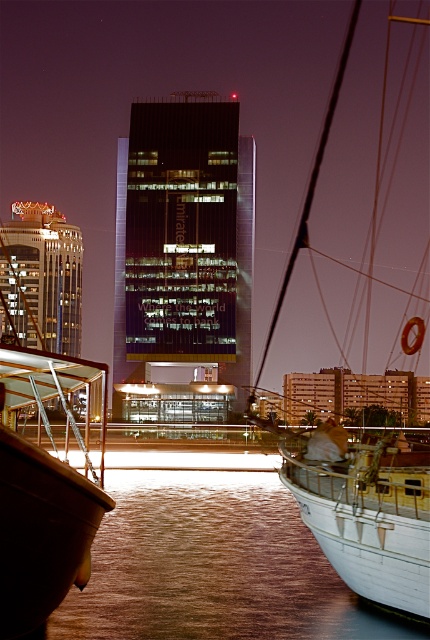
Question: Does brown liquid water at lower center have a greater width compared to white wooden boat at right?

Choices:
 (A) yes
 (B) no

Answer: (B)

Question: Does brown liquid water at lower center come behind white wooden boat at right?

Choices:
 (A) yes
 (B) no

Answer: (A)

Question: Which point appears closest to the camera in this image?

Choices:
 (A) (412, 531)
 (B) (144, 570)

Answer: (A)

Question: Which of the following is the closest to the observer?

Choices:
 (A) white wooden boat at right
 (B) brown liquid water at lower center

Answer: (A)

Question: Which object appears closest to the camera in this image?

Choices:
 (A) brown liquid water at lower center
 (B) white wooden boat at right

Answer: (B)

Question: In this image, where is brown liquid water at lower center located relative to white wooden boat at right?

Choices:
 (A) right
 (B) left

Answer: (B)